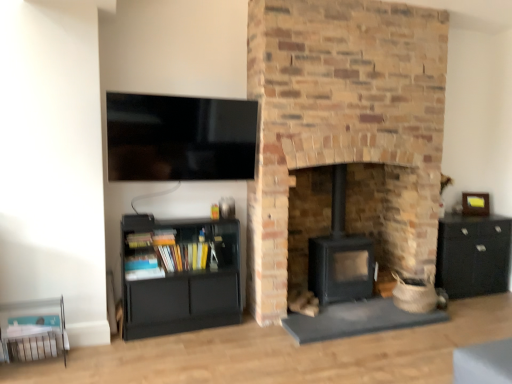
Question: Considering the relative sizes of flat screen tv at upper left and brick fireplace at center in the image provided, is flat screen tv at upper left smaller than brick fireplace at center?

Choices:
 (A) yes
 (B) no

Answer: (A)

Question: Is flat screen tv at upper left at the left side of brick fireplace at center?

Choices:
 (A) yes
 (B) no

Answer: (A)

Question: Does flat screen tv at upper left have a larger size compared to brick fireplace at center?

Choices:
 (A) yes
 (B) no

Answer: (B)

Question: Is brick fireplace at center surrounded by flat screen tv at upper left?

Choices:
 (A) no
 (B) yes

Answer: (A)

Question: Considering the relative positions of flat screen tv at upper left and brick fireplace at center in the image provided, is flat screen tv at upper left behind brick fireplace at center?

Choices:
 (A) yes
 (B) no

Answer: (A)

Question: Does flat screen tv at upper left come in front of brick fireplace at center?

Choices:
 (A) yes
 (B) no

Answer: (B)

Question: Considering the relative sizes of wooden picture frame at right and matte black bookshelf at lower left in the image provided, is wooden picture frame at right bigger than matte black bookshelf at lower left?

Choices:
 (A) yes
 (B) no

Answer: (B)

Question: Considering the relative sizes of wooden picture frame at right and matte black bookshelf at lower left in the image provided, is wooden picture frame at right thinner than matte black bookshelf at lower left?

Choices:
 (A) no
 (B) yes

Answer: (B)

Question: From the image's perspective, is wooden picture frame at right on matte black bookshelf at lower left?

Choices:
 (A) no
 (B) yes

Answer: (B)

Question: Considering the relative positions of wooden picture frame at right and matte black bookshelf at lower left in the image provided, is wooden picture frame at right behind matte black bookshelf at lower left?

Choices:
 (A) yes
 (B) no

Answer: (A)

Question: Is wooden picture frame at right surrounding matte black bookshelf at lower left?

Choices:
 (A) no
 (B) yes

Answer: (A)

Question: From a real-world perspective, is wooden picture frame at right positioned under matte black bookshelf at lower left based on gravity?

Choices:
 (A) no
 (B) yes

Answer: (A)

Question: From the image's perspective, is matte black bookshelf at lower left above wooden picture frame at right?

Choices:
 (A) no
 (B) yes

Answer: (A)